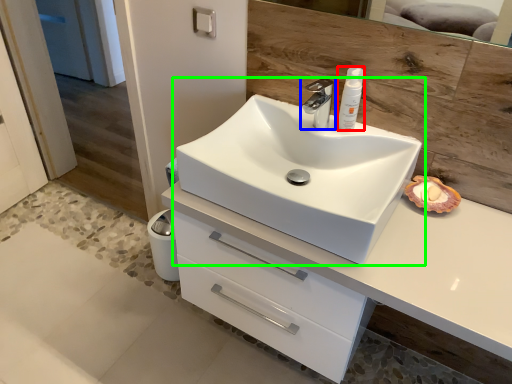
Question: Which object is the closest to the toiletry (highlighted by a red box)? Choose among these: tap (highlighted by a blue box) or sink (highlighted by a green box).

Choices:
 (A) tap
 (B) sink

Answer: (A)